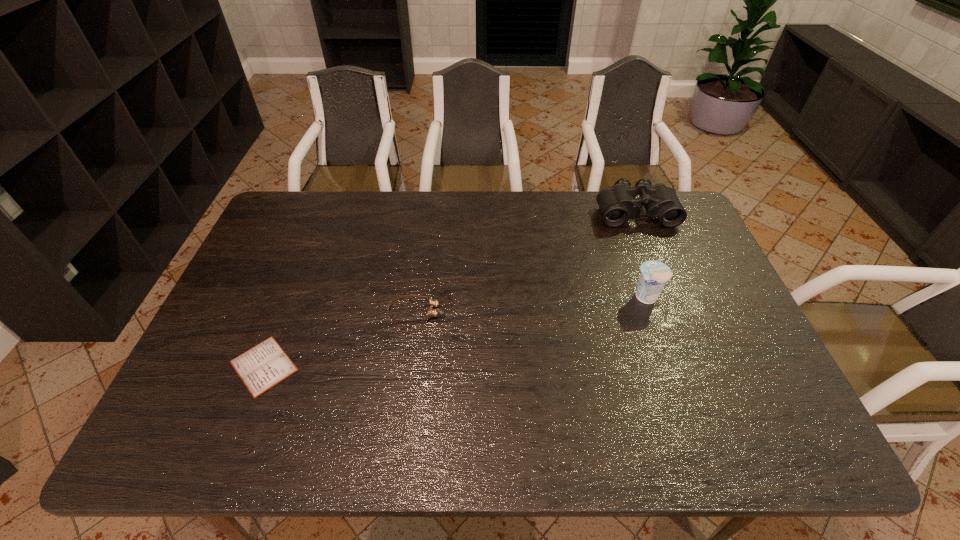
At what (x,y) coordinates should I click in order to perform the action: click on free space between the yogurt and the third tallest object. Please return your answer as a coordinate pair (x, y). Looking at the image, I should click on click(x=532, y=304).

Identify which object is the second nearest to the second shortest object. Please provide its 2D coordinates. Your answer should be formatted as a tuple, i.e. [(x, y)], where the tuple contains the x and y coordinates of a point satisfying the conditions above.

[(654, 274)]

Find the location of `object identified as the closest to the yogurt`. object identified as the closest to the yogurt is located at coordinates (617, 204).

Where is `free space that satisfies the following two spatial constraints: 1. at the eyepieces of the binoculars; 2. on the front lenses and sides of the goggles`? The image size is (960, 540). free space that satisfies the following two spatial constraints: 1. at the eyepieces of the binoculars; 2. on the front lenses and sides of the goggles is located at coordinates (675, 312).

Find the location of a particular element. free space that satisfies the following two spatial constraints: 1. at the eyepieces of the farthest object; 2. on the front lenses and sides of the third object from right to left is located at coordinates (675, 312).

Identify the location of free point that satisfies the following two spatial constraints: 1. at the eyepieces of the farthest object; 2. on the front lenses and sides of the goggles. (675, 312).